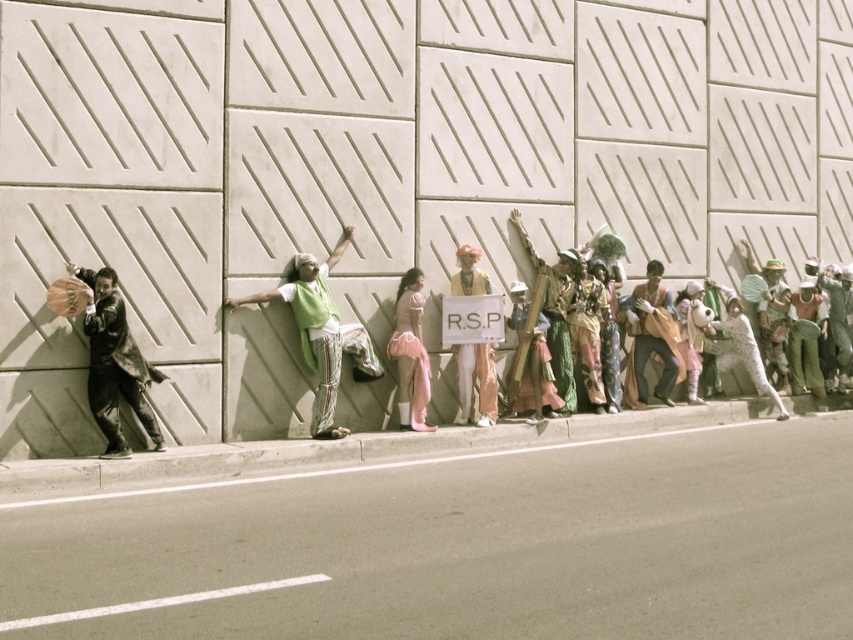
Question: Which point is closer to the camera?

Choices:
 (A) (486, 396)
 (B) (675, 417)
 (C) (138, 380)
 (D) (67, 612)

Answer: (D)

Question: Is pink satin dress at center below white asphalt line at lower center?

Choices:
 (A) yes
 (B) no

Answer: (B)

Question: Observing the image, what is the correct spatial positioning of white concrete wall at center in reference to matte black jacket at left?

Choices:
 (A) right
 (B) left

Answer: (A)

Question: Which of the following is the closest to the observer?

Choices:
 (A) green fabric at center
 (B) white paper sign at center

Answer: (A)

Question: Is concrete at lower left above matte black jacket at left?

Choices:
 (A) yes
 (B) no

Answer: (B)

Question: Which point is farther from the camera taking this photo?

Choices:
 (A) (96, 609)
 (B) (322, 353)
 (C) (467, 388)
 (D) (115, 280)

Answer: (C)